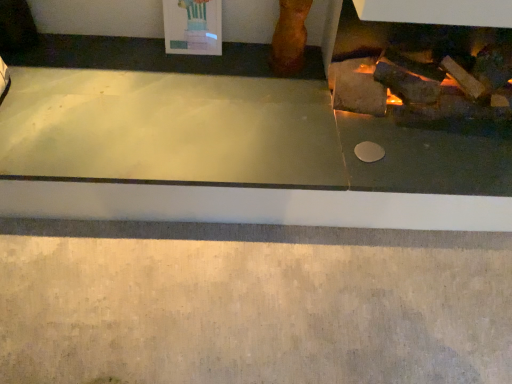
Question: Is smooth concrete at lower center to the left or to the right of matte stone fireplace at right in the image?

Choices:
 (A) left
 (B) right

Answer: (B)

Question: Is point (354, 337) closer or farther from the camera than point (312, 218)?

Choices:
 (A) farther
 (B) closer

Answer: (B)

Question: Is smooth concrete at lower center bigger or smaller than matte stone fireplace at right?

Choices:
 (A) small
 (B) big

Answer: (A)

Question: Choose the correct answer: Is matte stone fireplace at right inside smooth concrete at lower center or outside it?

Choices:
 (A) inside
 (B) outside

Answer: (B)

Question: Considering the positions of matte stone fireplace at right and smooth concrete at lower center in the image, is matte stone fireplace at right taller or shorter than smooth concrete at lower center?

Choices:
 (A) tall
 (B) short

Answer: (B)

Question: From a real-world perspective, is matte stone fireplace at right positioned above or below smooth concrete at lower center?

Choices:
 (A) above
 (B) below

Answer: (A)

Question: Visually, is matte stone fireplace at right positioned to the left or to the right of smooth concrete at lower center?

Choices:
 (A) left
 (B) right

Answer: (A)